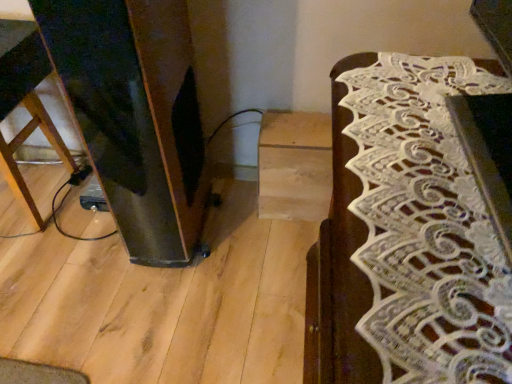
The width and height of the screenshot is (512, 384). I want to click on free space in front of wooden stool at left, arranged as the second furniture when viewed from the right, so click(x=30, y=256).